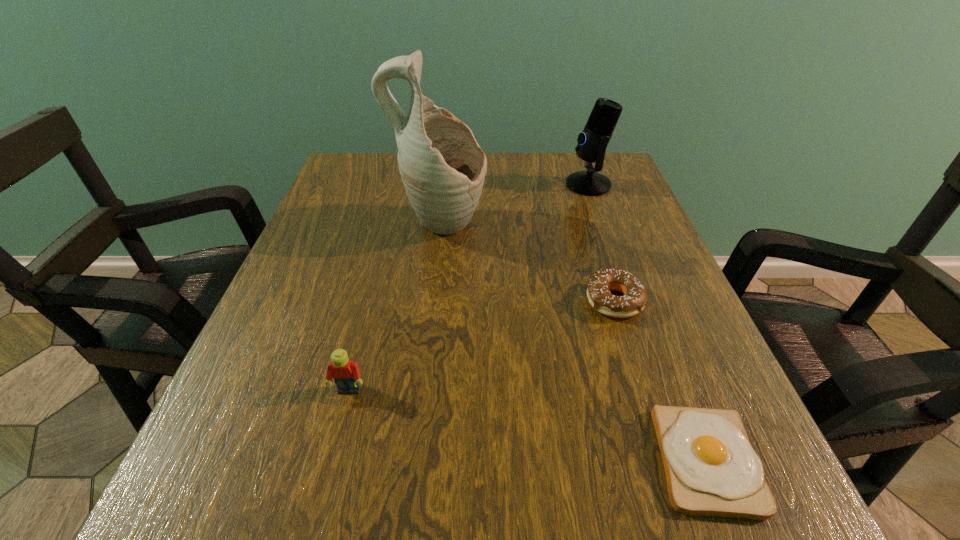
Find the location of `microphone situated at the right edge`. microphone situated at the right edge is located at coordinates (592, 142).

Where is `doughnut positioned at the right edge`? This screenshot has width=960, height=540. doughnut positioned at the right edge is located at coordinates (600, 283).

Locate an element on the screen. toast located at the right edge is located at coordinates (711, 469).

The height and width of the screenshot is (540, 960). I want to click on object positioned at the far right corner, so click(x=592, y=142).

The width and height of the screenshot is (960, 540). I want to click on object that is at the near right corner, so click(x=711, y=469).

Where is `free region at the far edge`? The image size is (960, 540). free region at the far edge is located at coordinates (537, 183).

In the image, there is a desktop. Where is `vacant space at the left edge`? vacant space at the left edge is located at coordinates (251, 457).

Where is `vacant space at the right edge of the desktop`? This screenshot has width=960, height=540. vacant space at the right edge of the desktop is located at coordinates (650, 327).

The image size is (960, 540). In the image, there is a desktop. What are the coordinates of `vacant space at the far left corner` in the screenshot? It's located at (363, 160).

The width and height of the screenshot is (960, 540). In the image, there is a desktop. Find the location of `vacant region at the far right corner`. vacant region at the far right corner is located at coordinates (570, 199).